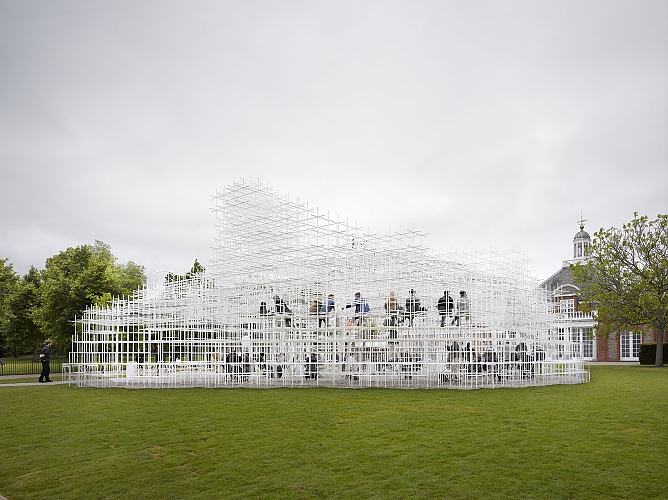
The image size is (668, 500). What are the coordinates of `doors` in the screenshot? It's located at (587, 350), (570, 349), (558, 348), (625, 349), (636, 349).